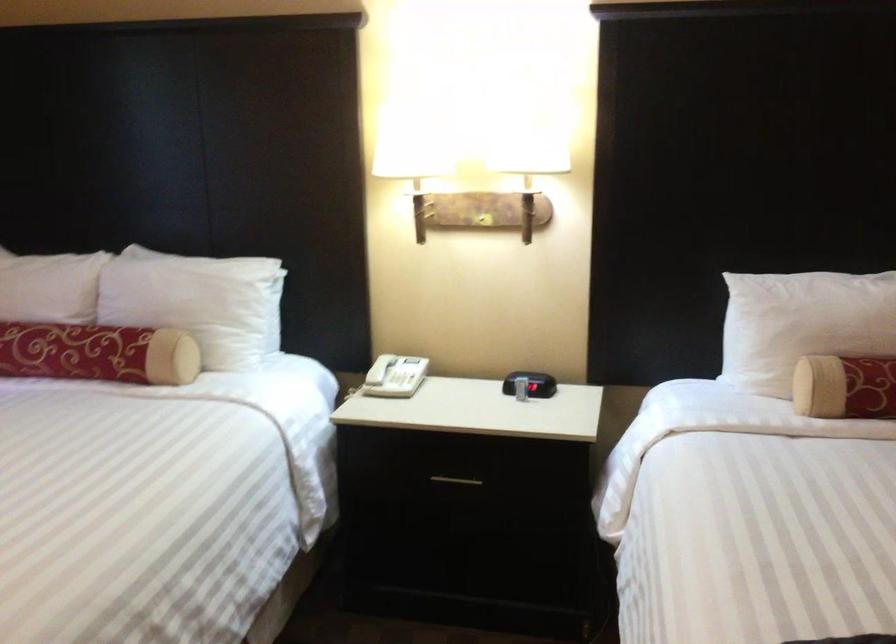
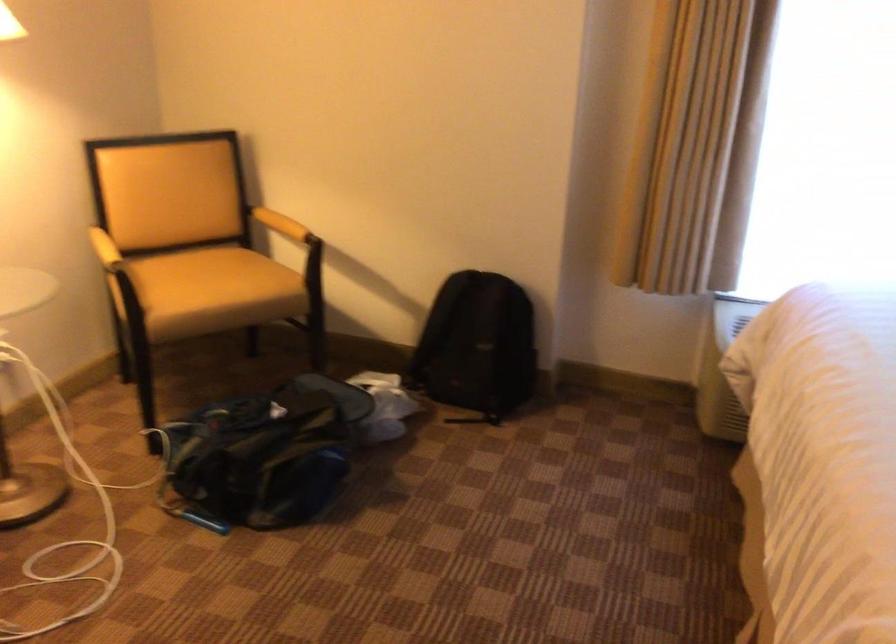
The first image is from the beginning of the video and the second image is from the end. How did the camera likely rotate when shooting the video?

The camera rotated toward left-down.